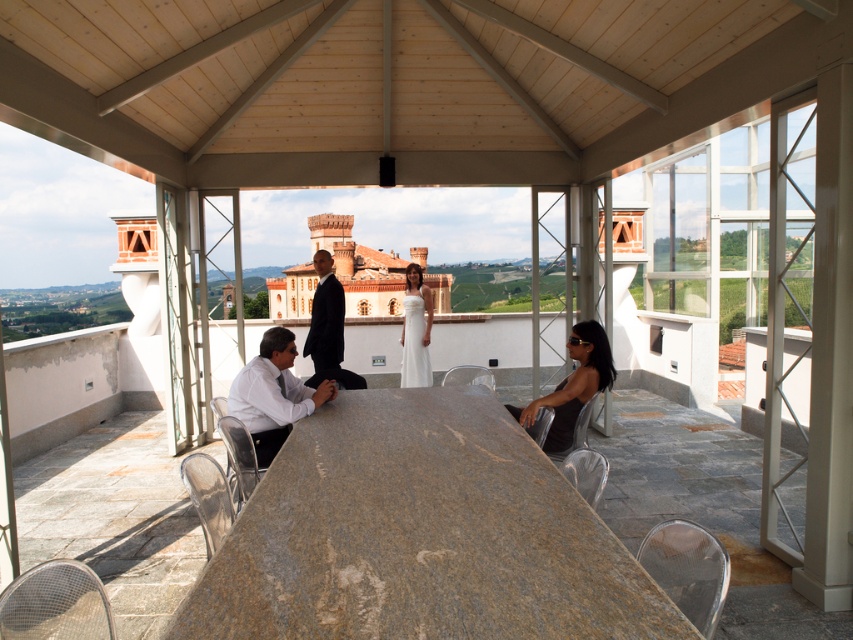
Does shiny silver dress at lower right appear over black suit at center?

No.

Which is above, shiny silver dress at lower right or black suit at center?

black suit at center is higher up.

Does point (595, 381) lie behind point (328, 371)?

No.

I want to click on shiny silver dress at lower right, so click(572, 385).

Which is behind, point (271, 396) or point (341, 355)?

Point (341, 355)

Is white glossy shirt at lower left shorter than black suit at center?

Correct, white glossy shirt at lower left is not as tall as black suit at center.

Is point (289, 376) more distant than point (311, 330)?

No, (289, 376) is in front of (311, 330).

Find the location of a particular element. The width and height of the screenshot is (853, 640). white glossy shirt at lower left is located at coordinates [x=273, y=394].

Is white glossy shirt at lower left thinner than white satin dress at center?

In fact, white glossy shirt at lower left might be wider than white satin dress at center.

Does white glossy shirt at lower left appear over white satin dress at center?

No, white glossy shirt at lower left is not above white satin dress at center.

The width and height of the screenshot is (853, 640). In order to click on white glossy shirt at lower left in this screenshot , I will do `click(273, 394)`.

Find the location of a particular element. white glossy shirt at lower left is located at coordinates (273, 394).